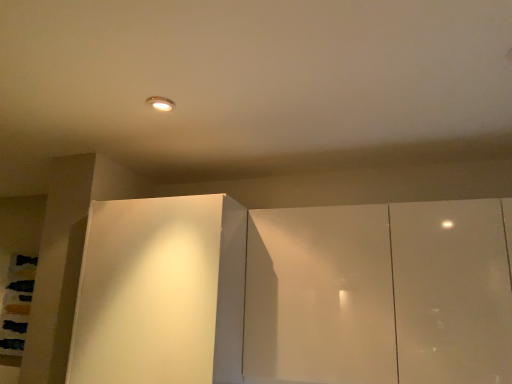
What do you see at coordinates (161, 292) in the screenshot? I see `white glossy cabinet at center` at bounding box center [161, 292].

Identify the location of white glossy cabinet at center. (161, 292).

At what (x,y) coordinates should I click in order to perform the action: click on glossy white cupboard at center. Please return your answer as a coordinate pair (x, y). Looking at the image, I should click on (293, 293).

Image resolution: width=512 pixels, height=384 pixels. Describe the element at coordinates (293, 293) in the screenshot. I see `glossy white cupboard at center` at that location.

Locate an element on the screen. This screenshot has width=512, height=384. white glossy cabinet at center is located at coordinates (161, 292).

Which is more to the right, glossy white cupboard at center or white glossy cabinet at center?

glossy white cupboard at center is more to the right.

Considering their positions, is glossy white cupboard at center located in front of or behind white glossy cabinet at center?

Clearly, glossy white cupboard at center is in front of white glossy cabinet at center.

Is point (350, 259) closer to camera compared to point (218, 318)?

No, it is behind (218, 318).

From the image's perspective, which object appears higher, glossy white cupboard at center or white glossy cabinet at center?

From the image's view, glossy white cupboard at center is above.

From a real-world perspective, which is physically below, glossy white cupboard at center or white glossy cabinet at center?

white glossy cabinet at center, from a real-world perspective.

In the scene shown: Is glossy white cupboard at center wider than white glossy cabinet at center?

No, glossy white cupboard at center is not wider than white glossy cabinet at center.

Does glossy white cupboard at center have a lesser height compared to white glossy cabinet at center?

Indeed, glossy white cupboard at center has a lesser height compared to white glossy cabinet at center.

Considering the sizes of objects glossy white cupboard at center and white glossy cabinet at center in the image provided, who is smaller, glossy white cupboard at center or white glossy cabinet at center?

glossy white cupboard at center.

Could white glossy cabinet at center be considered to be inside glossy white cupboard at center?

No, white glossy cabinet at center is located outside of glossy white cupboard at center.

Can you see glossy white cupboard at center touching white glossy cabinet at center?

No, glossy white cupboard at center is not with white glossy cabinet at center.

Is glossy white cupboard at center aimed at white glossy cabinet at center?

No, glossy white cupboard at center is not oriented towards white glossy cabinet at center.

How many degrees apart are the facing directions of glossy white cupboard at center and white glossy cabinet at center?

The angular difference between glossy white cupboard at center and white glossy cabinet at center is 0.00116 degrees.

At what (x,y) coordinates should I click in order to perform the action: click on glass door that appears behind the glossy white cupboard at center. Please return your answer as a coordinate pair (x, y). This screenshot has width=512, height=384. Looking at the image, I should click on coord(161,292).

Between white glossy cabinet at center and glossy white cupboard at center, which one appears on the left side from the viewer's perspective?

Positioned to the left is white glossy cabinet at center.

Is white glossy cabinet at center behind glossy white cupboard at center?

Yes, white glossy cabinet at center is further from the camera.

Between point (161, 239) and point (129, 371), which one is positioned behind?

The point (161, 239) is farther from the camera.

From the image's perspective, is white glossy cabinet at center located above glossy white cupboard at center?

No, from the image's perspective, white glossy cabinet at center is not over glossy white cupboard at center.

From a real-world perspective, who is located lower, white glossy cabinet at center or glossy white cupboard at center?

white glossy cabinet at center.

Considering the relative sizes of white glossy cabinet at center and glossy white cupboard at center in the image provided, is white glossy cabinet at center wider than glossy white cupboard at center?

Yes.

Is white glossy cabinet at center taller than glossy white cupboard at center?

Indeed, white glossy cabinet at center has a greater height compared to glossy white cupboard at center.

Which of these two, white glossy cabinet at center or glossy white cupboard at center, is smaller?

With smaller size is glossy white cupboard at center.

Would you say glossy white cupboard at center is part of white glossy cabinet at center's contents?

Definitely not — glossy white cupboard at center is not inside white glossy cabinet at center.

Consider the image. Is white glossy cabinet at center beside glossy white cupboard at center?

There is a gap between white glossy cabinet at center and glossy white cupboard at center.

Is white glossy cabinet at center aimed at glossy white cupboard at center?

No, white glossy cabinet at center does not turn towards glossy white cupboard at center.

How many degrees apart are the facing directions of white glossy cabinet at center and glossy white cupboard at center?

0.00116 degrees.

How distant is white glossy cabinet at center from glossy white cupboard at center?

white glossy cabinet at center and glossy white cupboard at center are 5.23 inches apart from each other.

Locate an element on the screen. The image size is (512, 384). glass door that is under the glossy white cupboard at center (from a real-world perspective) is located at coordinates [161, 292].

Where is `cupboard that appears in front of the white glossy cabinet at center`? cupboard that appears in front of the white glossy cabinet at center is located at coordinates (293, 293).

Locate an element on the screen. This screenshot has width=512, height=384. glass door that is behind the glossy white cupboard at center is located at coordinates (161, 292).